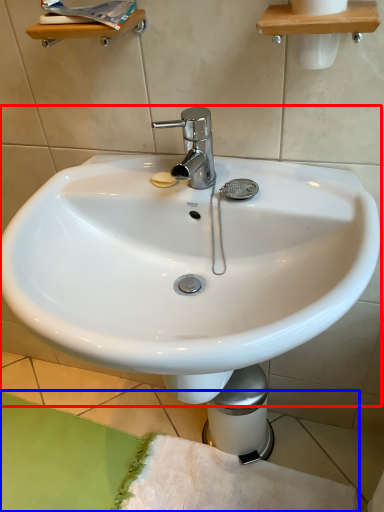
Question: Among these objects, which one is nearest to the camera, sink (highlighted by a red box) or bath mat (highlighted by a blue box)?

Choices:
 (A) sink
 (B) bath mat

Answer: (A)